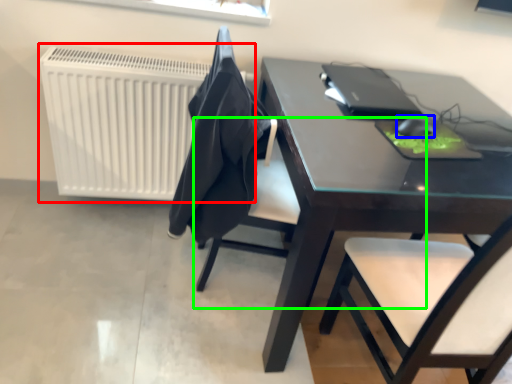
Question: Considering the real-world distances, which object is farthest from radiator (highlighted by a red box)? mouse (highlighted by a blue box) or chair (highlighted by a green box)?

Choices:
 (A) mouse
 (B) chair

Answer: (A)